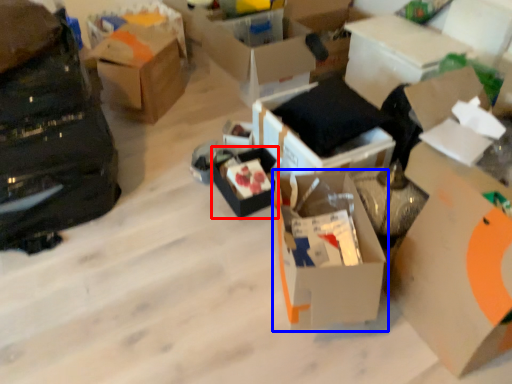
Question: Among these objects, which one is farthest to the camera, box (highlighted by a red box) or box (highlighted by a blue box)?

Choices:
 (A) box
 (B) box

Answer: (A)